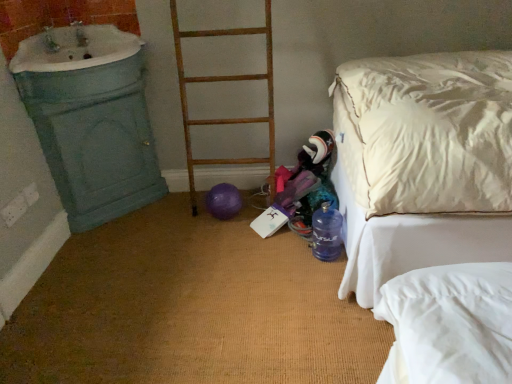
At what (x,y) coordinates should I click in order to perform the action: click on vacant space in between purple rubber balloon at center and rusty wood ladder at center. Please return your answer as a coordinate pair (x, y). Looking at the image, I should click on (206, 213).